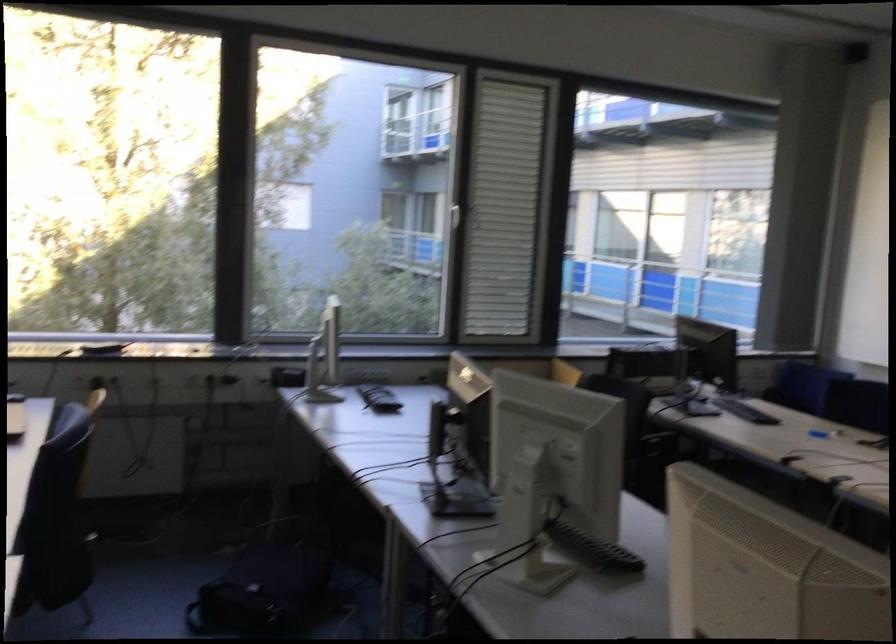
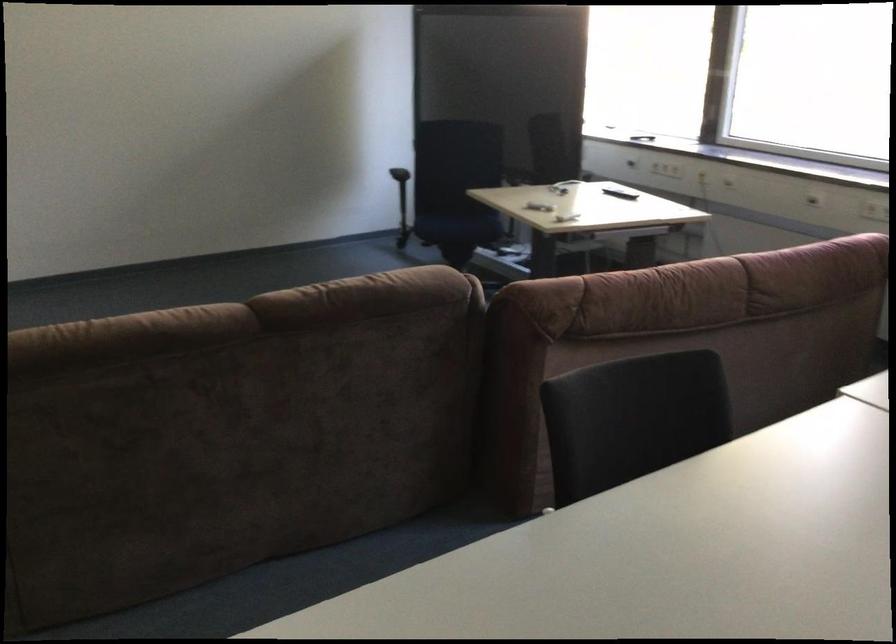
Based on the continuous images, in which direction is the camera rotating?

The camera rotated toward left-down.